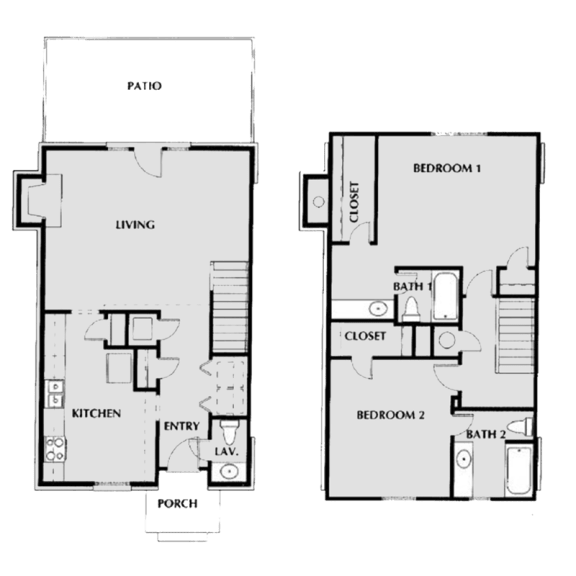
Image resolution: width=576 pixels, height=576 pixels. Identify the location of front doorway. click(x=183, y=468).